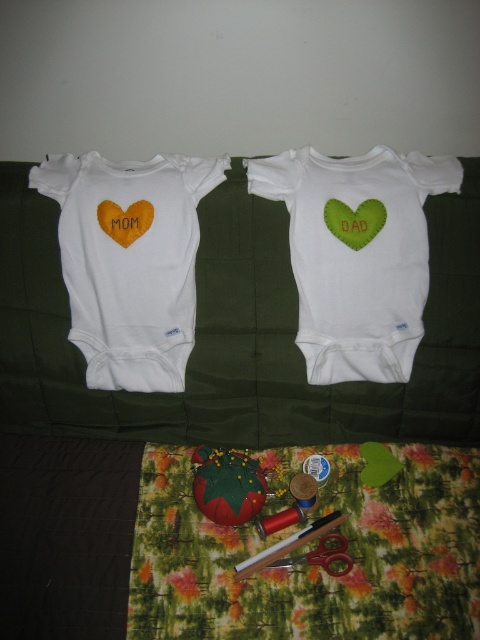
You are standing 4 feet away from the dark green cushioned surface. A point at coordinate point [337,234] is located on the surface. Can you reach this point without moving closer than 3.5 feet?

The distance of point [337,234] from viewer is 3.59 feet. Since you are standing 4 feet away, you are 0.41 feet farther than the required 3.5 feet. Therefore, you can reach the point without moving closer than 3.5 feet.

You are looking at the image of the two baby onesies and the sewing materials. There are two points marked in the image. Which of the two points, point (145, 365) or point (343, 548), is closer to you?

Point (145, 365) is closer to you because it is further to the camera than point (343, 548).